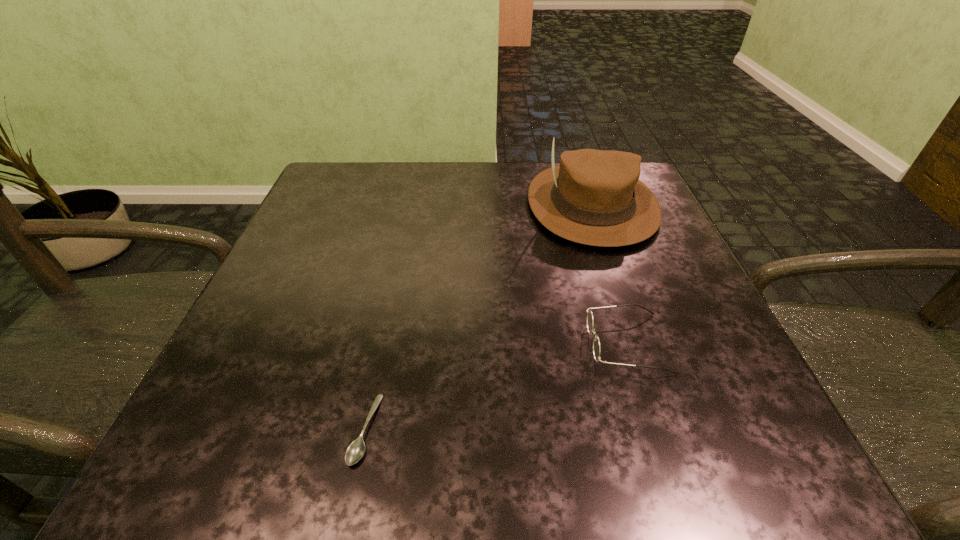
Find the location of a particular element. free spot between the shortest object and the spectacles is located at coordinates (496, 386).

Where is `free spot between the tallest object and the nearest object`? This screenshot has width=960, height=540. free spot between the tallest object and the nearest object is located at coordinates (478, 317).

Find the location of `object that is the closest to the tallest object`. object that is the closest to the tallest object is located at coordinates (596, 343).

Point out which object is positioned as the nearest to the fedora. Please provide its 2D coordinates. Your answer should be formatted as a tuple, i.e. [(x, y)], where the tuple contains the x and y coordinates of a point satisfying the conditions above.

[(596, 343)]

Locate an element on the screen. The width and height of the screenshot is (960, 540). free space that satisfies the following two spatial constraints: 1. on the feather side of the tallest object; 2. through the lenses of the second tallest object is located at coordinates (639, 343).

You are a GUI agent. You are given a task and a screenshot of the screen. Output one action in this format:
    pyautogui.click(x=<x>, y=<y>)
    Task: Click on the vacant space that satisfies the following two spatial constraints: 1. on the feather side of the farthest object; 2. through the lenses of the second farthest object
    This screenshot has width=960, height=540.
    Given the screenshot: What is the action you would take?
    pyautogui.click(x=639, y=343)

What are the coordinates of `vacant space that satisfies the following two spatial constraints: 1. on the feather side of the tallest object; 2. through the lenses of the second nearest object` in the screenshot? It's located at (639, 343).

The height and width of the screenshot is (540, 960). I want to click on free space in the image that satisfies the following two spatial constraints: 1. on the feather side of the fedora; 2. through the lenses of the second tallest object, so click(x=639, y=343).

Where is `free space that satisfies the following two spatial constraints: 1. on the feather side of the fedora; 2. through the lenses of the second tallest object`? The image size is (960, 540). free space that satisfies the following two spatial constraints: 1. on the feather side of the fedora; 2. through the lenses of the second tallest object is located at coordinates (639, 343).

The height and width of the screenshot is (540, 960). I want to click on vacant space that satisfies the following two spatial constraints: 1. on the feather side of the tallest object; 2. through the lenses of the spectacles, so click(639, 343).